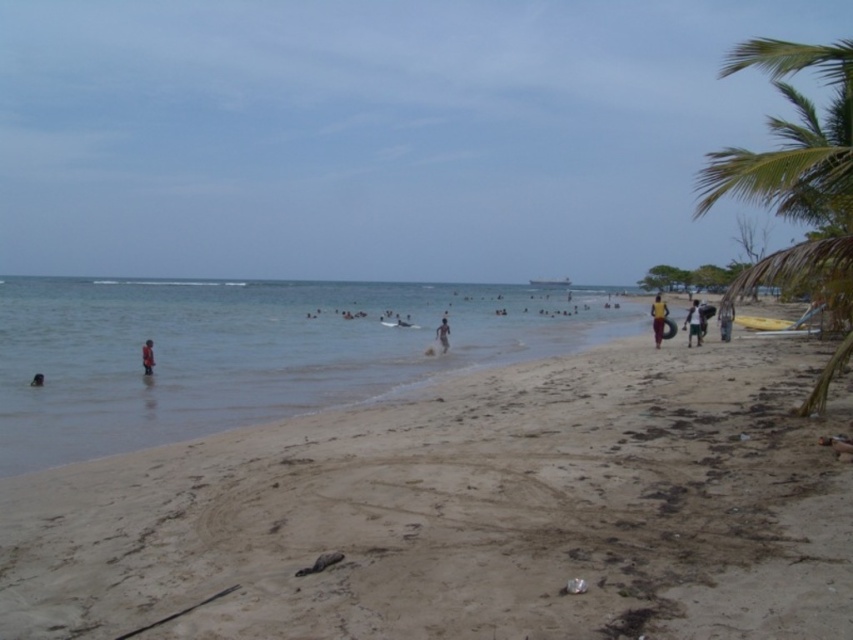
What do you see at coordinates (410, 474) in the screenshot? The image size is (853, 640). I see `brown sandy beach at lower left` at bounding box center [410, 474].

Does point (703, 385) come closer to viewer compared to point (851, 216)?

Yes, point (703, 385) is in front of point (851, 216).

Between point (248, 572) and point (788, 42), which one is positioned behind?

Point (788, 42)

Find the location of a particular element. brown sandy beach at lower left is located at coordinates (410, 474).

Is orange fabric person at lower left to the right of light brown sand at center from the viewer's perspective?

In fact, orange fabric person at lower left is to the left of light brown sand at center.

Between point (144, 364) and point (437, 330), which one is positioned in front?

Point (144, 364)

Locate an element on the screen. This screenshot has height=640, width=853. orange fabric person at lower left is located at coordinates (148, 356).

Does brown sandy beach at lower left have a lesser height compared to dark skin human at lower left?

Incorrect, brown sandy beach at lower left's height does not fall short of dark skin human at lower left's.

Between point (432, 317) and point (38, 372), which one is positioned in front?

Point (38, 372)

Is point (686, 376) positioned in front of point (33, 385)?

That is True.

Where is `brown sandy beach at lower left`? This screenshot has width=853, height=640. brown sandy beach at lower left is located at coordinates (410, 474).